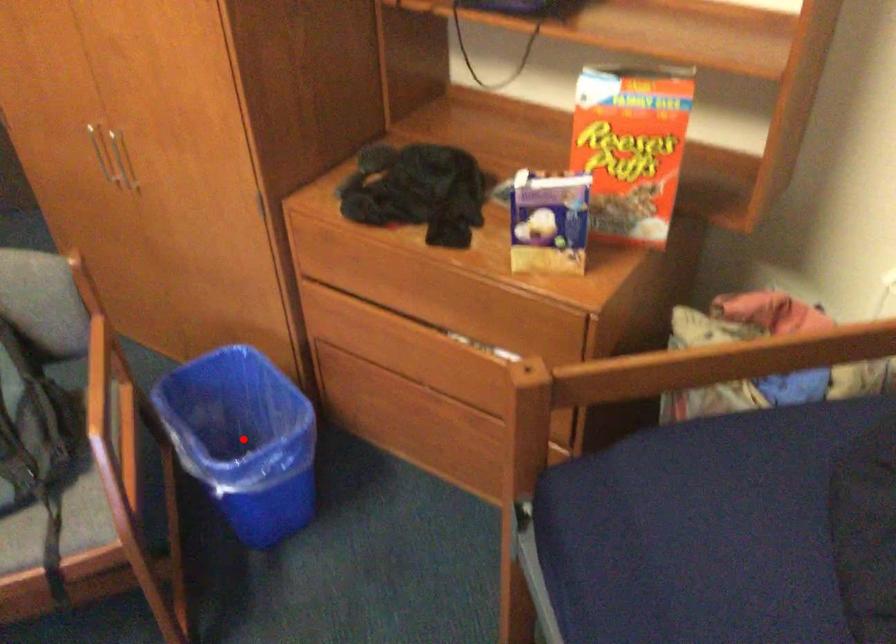
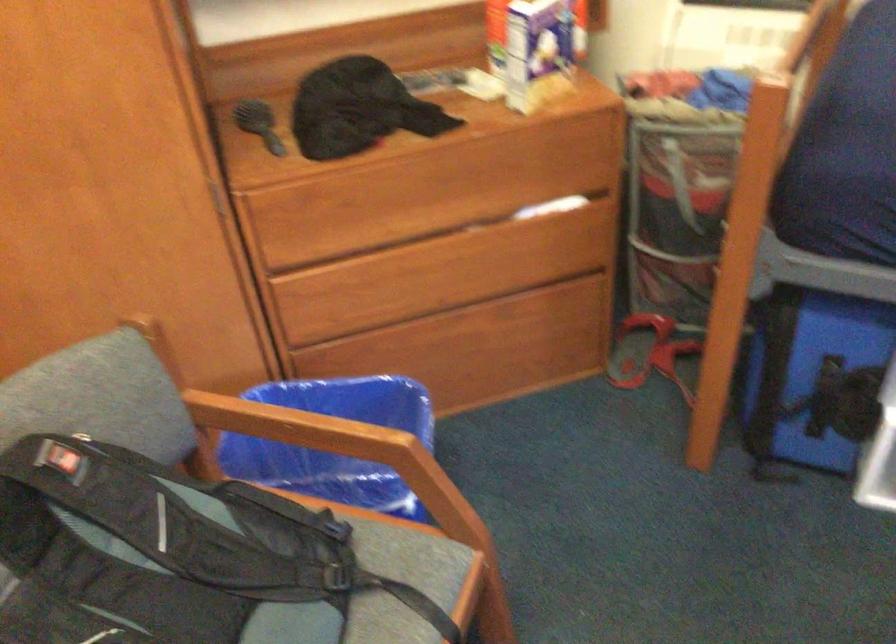
Question: I am providing you with two images of the same scene from different viewpoints. A red point is marked on the first image. At the location where the point appears in image 1, is it still visible in image 2?

Choices:
 (A) Yes
 (B) No

Answer: (B)